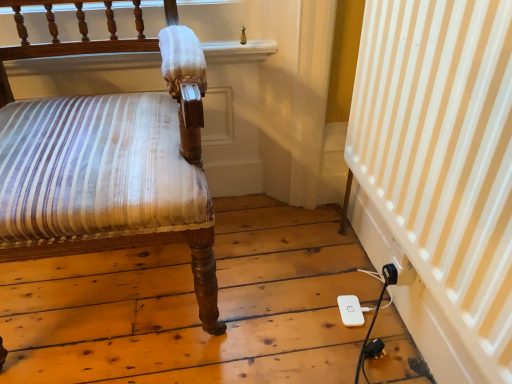
Find the location of a particular element. The height and width of the screenshot is (384, 512). free space to the left of white plastic ipod at lower right is located at coordinates (293, 307).